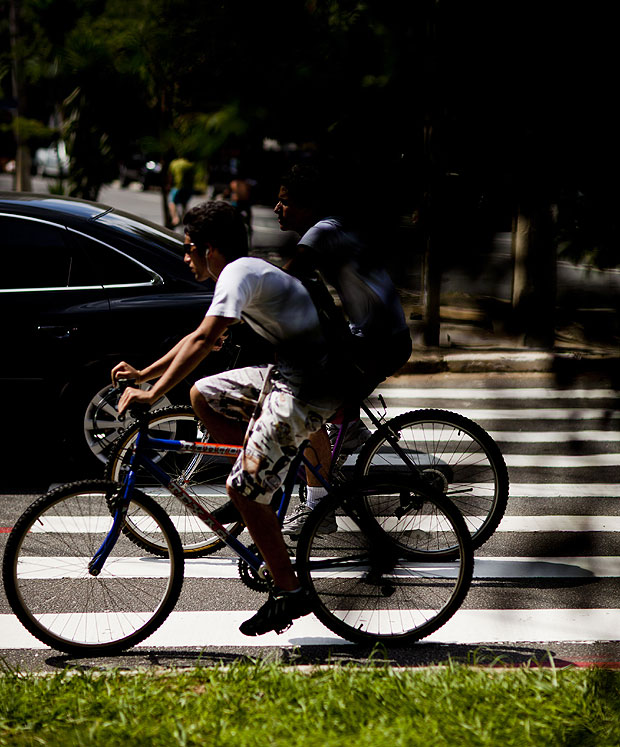
This screenshot has height=747, width=620. In order to click on windows in this screenshot , I will do `click(135, 220)`, `click(33, 247)`.